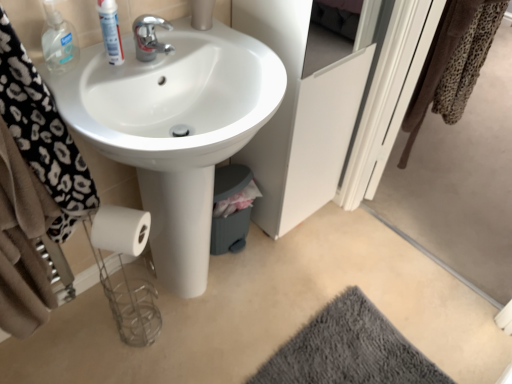
Where is `vacant space underneath transparent plastic screen door at upper right, arranged as the first screen door when viewed from the right (from a real-world perspective)`? Image resolution: width=512 pixels, height=384 pixels. vacant space underneath transparent plastic screen door at upper right, arranged as the first screen door when viewed from the right (from a real-world perspective) is located at coordinates (406, 253).